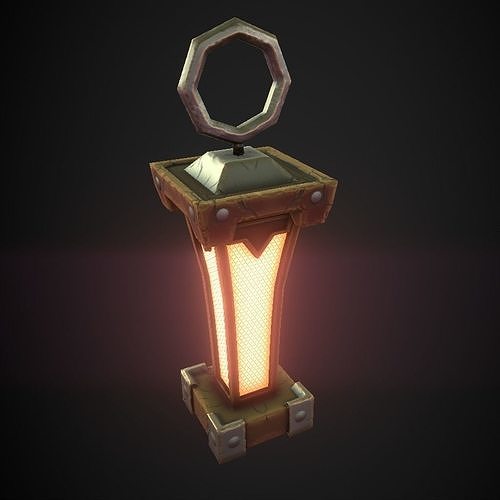
This screenshot has width=500, height=500. Find the location of `glass pane`. glass pane is located at coordinates (255, 298), (222, 333).